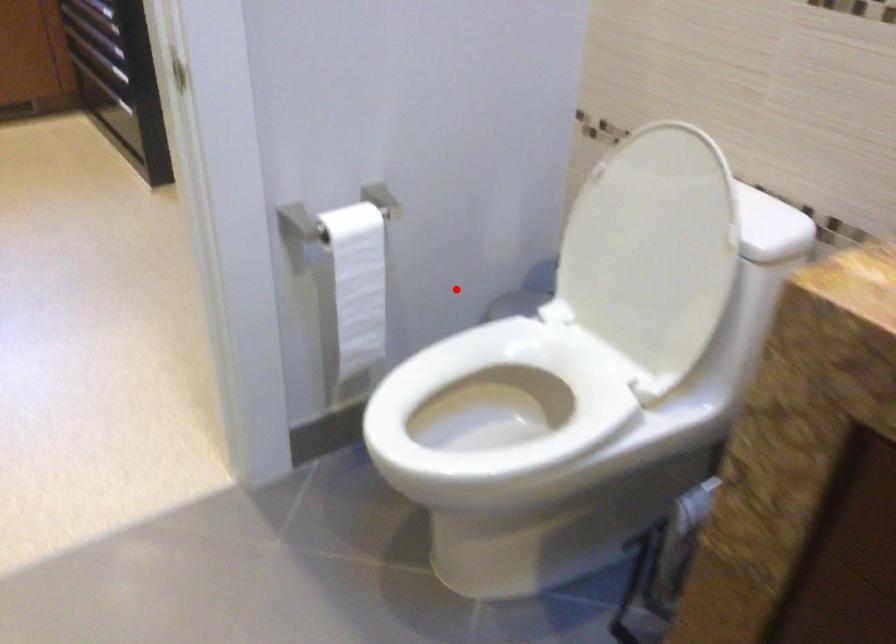
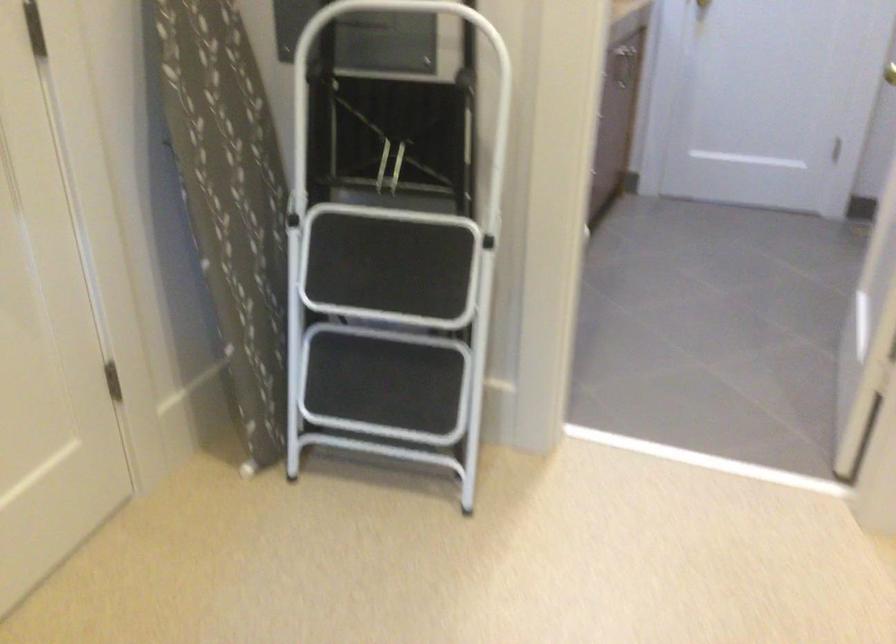
Locate, in the second image, the point that corresponds to the highlighted location in the first image.

(371, 324)